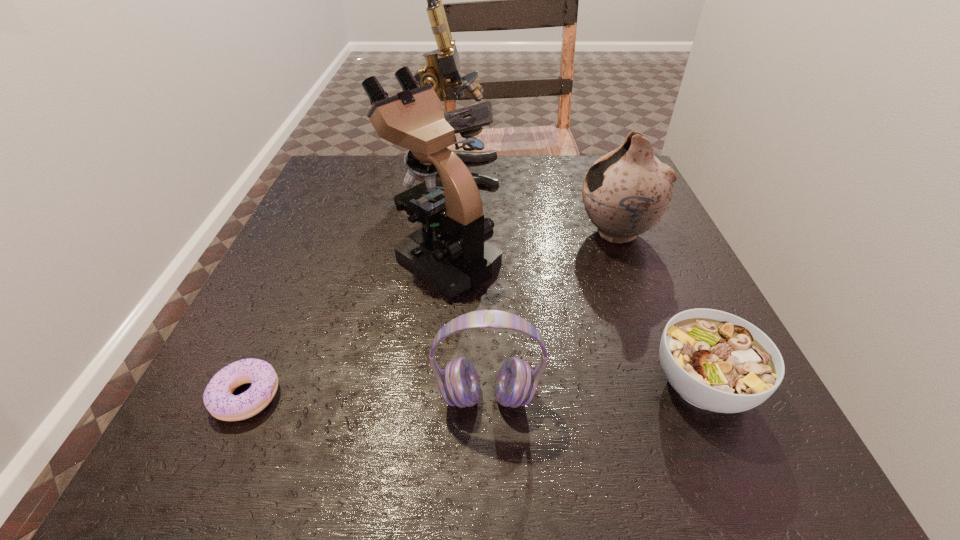
Where is `free space between the fifth tallest object and the farthest object`? Image resolution: width=960 pixels, height=540 pixels. free space between the fifth tallest object and the farthest object is located at coordinates (580, 279).

Where is `vacant area that lies between the soup bowl and the tallest object`? This screenshot has height=540, width=960. vacant area that lies between the soup bowl and the tallest object is located at coordinates (580, 279).

This screenshot has height=540, width=960. Find the location of `free point between the taller microscope and the soup bowl`. free point between the taller microscope and the soup bowl is located at coordinates (580, 279).

Image resolution: width=960 pixels, height=540 pixels. Identify the location of blank region between the fourth shortest object and the headset. (552, 315).

Find the location of a particular element. The height and width of the screenshot is (540, 960). unoccupied area between the shorter microscope and the second shortest object is located at coordinates (572, 322).

You are a GUI agent. You are given a task and a screenshot of the screen. Output one action in this format:
    pyautogui.click(x=<x>, y=<y>)
    Task: Click on the vacant area that lies between the third shortest object and the leftmost object
    The image size is (960, 540).
    Given the screenshot: What is the action you would take?
    click(x=367, y=396)

Identify the location of object that is the third closest to the soup bowl. This screenshot has width=960, height=540. (450, 252).

Find the location of `object that is the third closest one to the fifth tallest object`. object that is the third closest one to the fifth tallest object is located at coordinates (450, 252).

The height and width of the screenshot is (540, 960). I want to click on free space in the image that satisfies the following two spatial constraints: 1. on the front side of the second tallest object; 2. on the right side of the soup bowl, so click(430, 385).

This screenshot has width=960, height=540. In order to click on blank area in the image that satisfies the following two spatial constraints: 1. from the spout of the fourth shortest object; 2. on the front side of the second tallest object in this screenshot , I will do `click(626, 259)`.